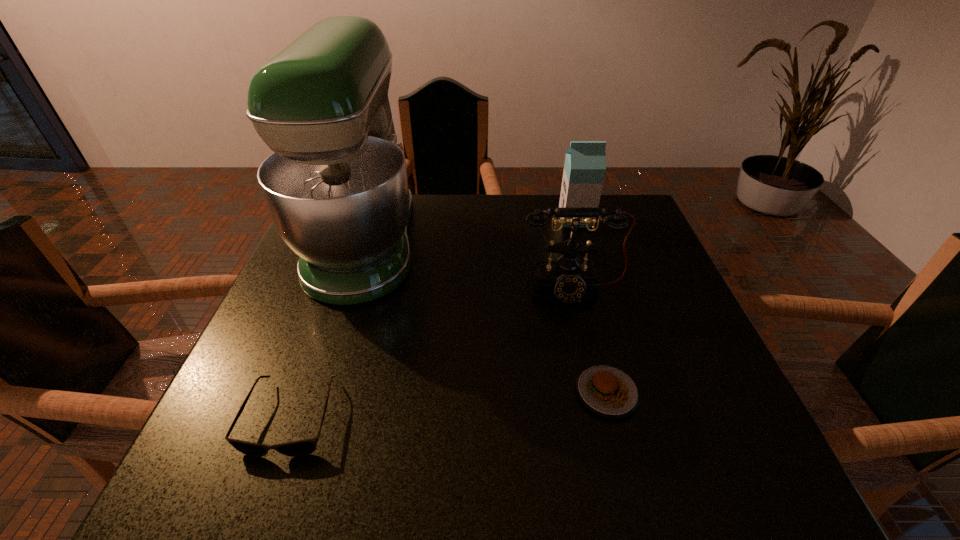
Locate an element on the screen. Image resolution: width=960 pixels, height=540 pixels. free space between the milk carton and the food is located at coordinates point(591,306).

What are the coordinates of `object that is the third nearest to the milk carton` in the screenshot? It's located at (606, 390).

Locate which object is the fourth closest to the mixer. Please provide its 2D coordinates. Your answer should be formatted as a tuple, i.e. [(x, y)], where the tuple contains the x and y coordinates of a point satisfying the conditions above.

[(585, 162)]

Locate an element on the screen. free space in the image that satisfies the following two spatial constraints: 1. on the dial of the food; 2. on the left side of the telephone is located at coordinates (596, 393).

The height and width of the screenshot is (540, 960). Identify the location of free region that satisfies the following two spatial constraints: 1. on the back side of the milk carton; 2. on the left side of the food. (563, 219).

Image resolution: width=960 pixels, height=540 pixels. Identify the location of free space that satisfies the following two spatial constraints: 1. on the controls of the tallest object; 2. on the left side of the food. (316, 393).

Where is `free spot that satisfies the following two spatial constraints: 1. on the controls of the food; 2. on the right side of the mixer`? Image resolution: width=960 pixels, height=540 pixels. free spot that satisfies the following two spatial constraints: 1. on the controls of the food; 2. on the right side of the mixer is located at coordinates (316, 393).

The height and width of the screenshot is (540, 960). Identify the location of vacant position in the image that satisfies the following two spatial constraints: 1. on the dial of the food; 2. on the right side of the telephone. (596, 393).